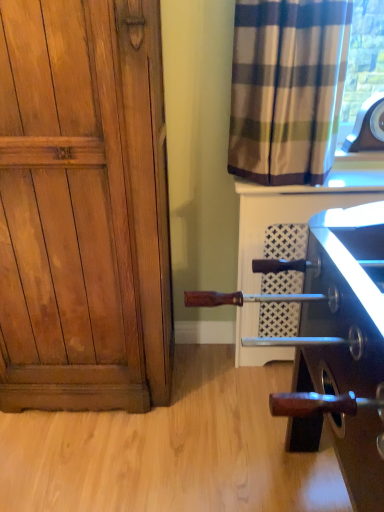
The image size is (384, 512). Identify the location of free space to the right of wooden paneling at left. (221, 408).